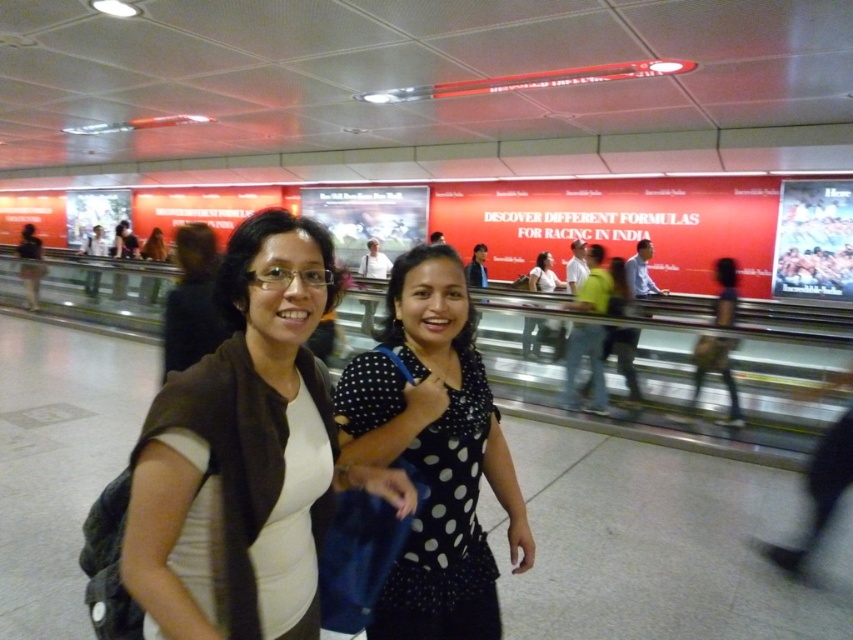
Question: Which of the following is the closest to the observer?

Choices:
 (A) (544, 323)
 (B) (381, 436)
 (C) (225, 484)

Answer: (C)

Question: Does white matte shirt at center appear under black dotted dress at center?

Choices:
 (A) no
 (B) yes

Answer: (A)

Question: Which object is farther from the camera taking this photo?

Choices:
 (A) polka dot blouse at center
 (B) white matte shirt at center
 (C) black dotted dress at center

Answer: (A)

Question: Does white matte shirt at center lie in front of polka dot blouse at center?

Choices:
 (A) no
 (B) yes

Answer: (B)

Question: Which object appears farthest from the camera in this image?

Choices:
 (A) black dotted dress at center
 (B) polka dot blouse at center

Answer: (B)

Question: Is the position of black dotted dress at center less distant than that of polka dot blouse at center?

Choices:
 (A) no
 (B) yes

Answer: (B)